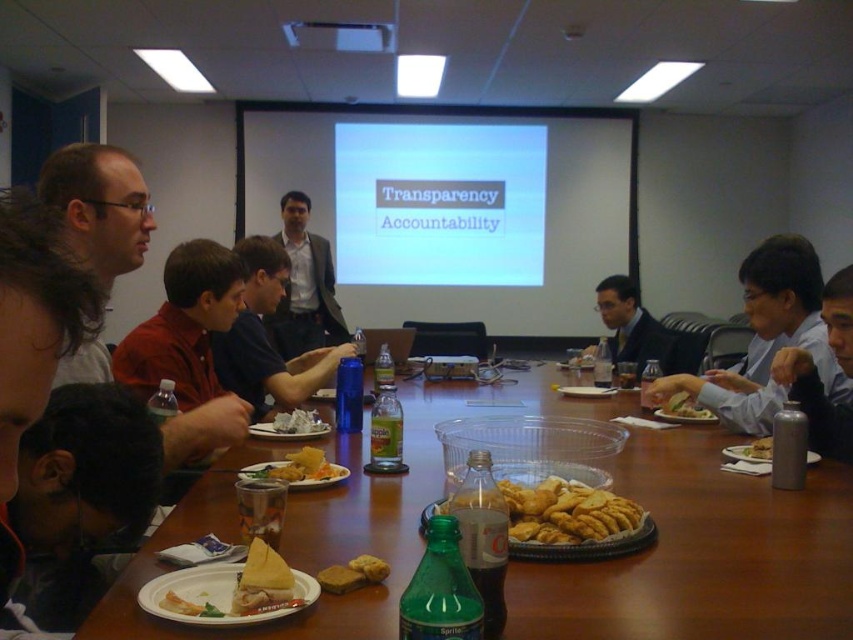
Which is behind, point (672, 394) or point (770, 444)?

The point (672, 394) is more distant.

Which is in front, point (672, 413) or point (747, 454)?

Positioned in front is point (747, 454).

You are a GUI agent. You are given a task and a screenshot of the screen. Output one action in this format:
    pyautogui.click(x=<x>, y=<y>)
    Task: Click on the shiny plastic container at center
    
    Given the screenshot: What is the action you would take?
    pyautogui.click(x=683, y=406)

Image resolution: width=853 pixels, height=640 pixels. I want to click on white glossy projector screen at upper center, so click(x=448, y=212).

I want to click on white glossy projector screen at upper center, so click(448, 212).

Identify the location of white glossy projector screen at upper center. This screenshot has width=853, height=640. (448, 212).

Which is more to the right, matte black suit at center or golden crisp pastry at center?

matte black suit at center is more to the right.

What are the coordinates of `matte black suit at center` in the screenshot? It's located at (630, 324).